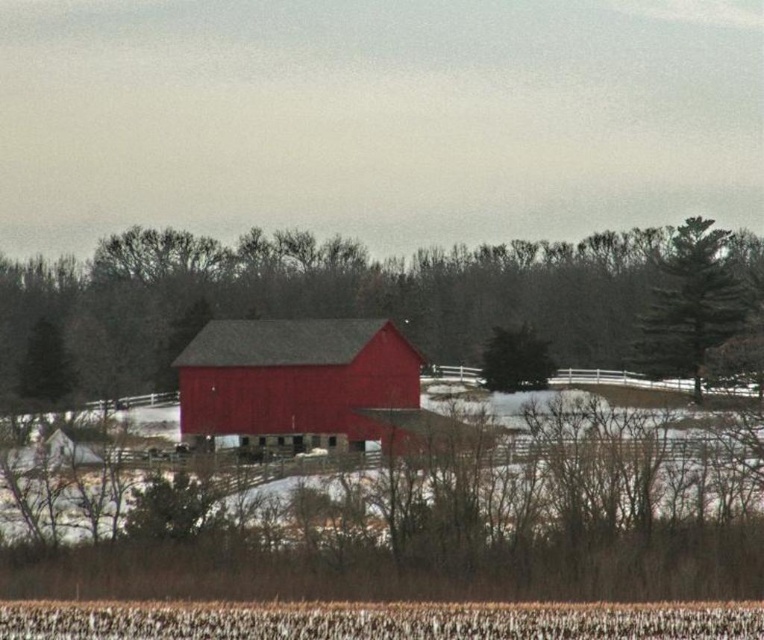
Question: Which is nearer to the matte red barn at center?

Choices:
 (A) smooth bark tree at center
 (B) green matte tree at center
 (C) green textured tree at upper right

Answer: (B)

Question: Is matte red barn at center to the right of green matte tree at center from the viewer's perspective?

Choices:
 (A) no
 (B) yes

Answer: (A)

Question: Which point is farther to the camera?

Choices:
 (A) green textured tree at upper right
 (B) smooth bark tree at center

Answer: (B)

Question: Can you confirm if green textured tree at upper right is positioned to the right of green matte tree at center?

Choices:
 (A) no
 (B) yes

Answer: (B)

Question: Which point is farther to the camera?

Choices:
 (A) matte red barn at center
 (B) green textured tree at upper right

Answer: (B)

Question: Does green textured tree at upper right appear on the left side of green matte tree at center?

Choices:
 (A) no
 (B) yes

Answer: (A)